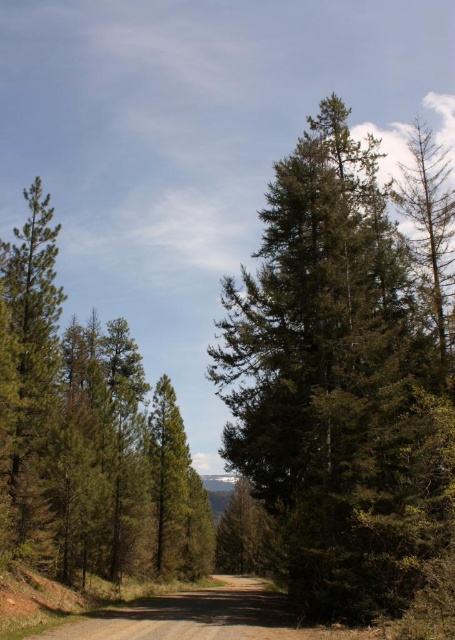
You are standing at the center of the dirt road in the forest scene. You want to walk towards the horizon where the road converges. Which direction should you go to avoid the green textured pine tree at left?

To avoid the green textured pine tree at left, you should walk towards the right side of the dirt road since the tree is located on the left side.

You are a hiker trying to navigate through the forest. You see the green textured tree at center and the brown gravel road at center. Which one is larger in size?

The green textured tree at center is bigger than the brown gravel road at center.

You are standing at the starting point of the dirt road in the forest scene. You notice a green textured tree at center. Based on its 2D location coordinates, can you determine if the tree is positioned to the left or right side of the road?

The green textured tree at center is located at coordinates 0.583 on the x and 0.760 on the y. Since the x coordinate is 0.583, which is slightly to the right of the center point of 0.5, the tree is positioned to the right side of the road.